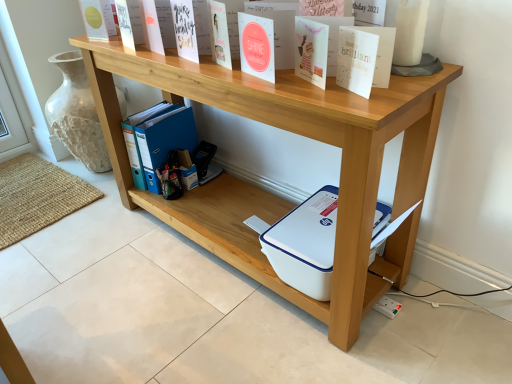
Question: Can you confirm if natural wood shelf at upper center, placed as the 2th shelf when sorted from bottom to top, is shorter than matte yellow card at upper left, which is counted as the third paperback book, starting from the bottom?

Choices:
 (A) yes
 (B) no

Answer: (B)

Question: Can you confirm if natural wood shelf at upper center, placed as the 2th shelf when sorted from bottom to top, is positioned to the left of matte yellow card at upper left, which is counted as the third paperback book, starting from the front?

Choices:
 (A) yes
 (B) no

Answer: (B)

Question: From the image's perspective, is natural wood shelf at upper center, placed as the 2th shelf when sorted from bottom to top, above matte yellow card at upper left, the 1th paperback book in the top-to-bottom sequence?

Choices:
 (A) no
 (B) yes

Answer: (A)

Question: Can you confirm if natural wood shelf at upper center, which appears as the 1th shelf when viewed from the top, is bigger than matte yellow card at upper left, the 1th paperback book in the top-to-bottom sequence?

Choices:
 (A) yes
 (B) no

Answer: (A)

Question: From a real-world perspective, is natural wood shelf at upper center, placed as the 2th shelf when sorted from bottom to top, under matte yellow card at upper left, which is counted as the third paperback book, starting from the bottom?

Choices:
 (A) yes
 (B) no

Answer: (A)

Question: Is natural wood shelf at upper center, placed as the 2th shelf when sorted from bottom to top, oriented towards matte yellow card at upper left, which is counted as the third paperback book, starting from the bottom?

Choices:
 (A) yes
 (B) no

Answer: (B)

Question: Does white plastic printer at lower center, positioned as the 2th shelf in top-to-bottom order, have a smaller size compared to matte blue notebook at upper center, positioned as the second paperback book in front-to-back order?

Choices:
 (A) yes
 (B) no

Answer: (B)

Question: Is white plastic printer at lower center, positioned as the 2th shelf in top-to-bottom order, not inside matte blue notebook at upper center, marked as the 2th paperback book in a top-to-bottom arrangement?

Choices:
 (A) no
 (B) yes

Answer: (B)

Question: Does white plastic printer at lower center, positioned as the 2th shelf in top-to-bottom order, turn towards matte blue notebook at upper center, which is counted as the 2th paperback book, starting from the right?

Choices:
 (A) yes
 (B) no

Answer: (B)

Question: From a real-world perspective, is white plastic printer at lower center, positioned as the 2th shelf in top-to-bottom order, positioned under matte blue notebook at upper center, positioned as the second paperback book in front-to-back order, based on gravity?

Choices:
 (A) no
 (B) yes

Answer: (B)

Question: Is white plastic printer at lower center, positioned as the 2th shelf in top-to-bottom order, touching matte blue notebook at upper center, which is counted as the 2th paperback book, starting from the right?

Choices:
 (A) no
 (B) yes

Answer: (A)

Question: Does white plastic printer at lower center, which appears as the 1th shelf when ordered from the bottom, appear on the left side of matte blue notebook at upper center, which is counted as the 2th paperback book, starting from the right?

Choices:
 (A) yes
 (B) no

Answer: (B)

Question: From the image's perspective, is matte yellow card at upper left, which is counted as the third paperback book, starting from the bottom, over blue plastic ring binder at lower center?

Choices:
 (A) yes
 (B) no

Answer: (A)